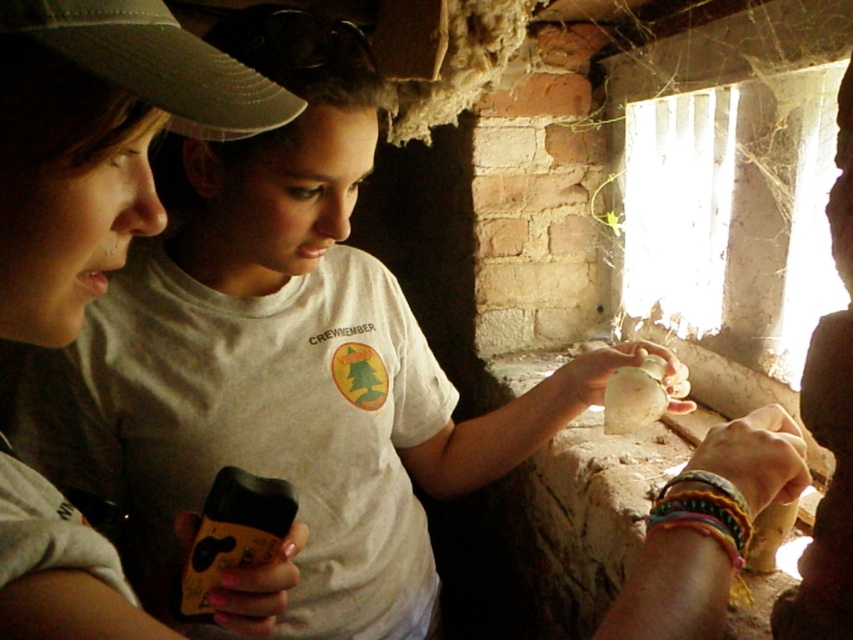
Question: Which point is farther to the camera?

Choices:
 (A) (238, 552)
 (B) (631, 381)
 (C) (83, 566)
 (D) (164, 67)

Answer: (B)

Question: Does white matte shirt at center have a smaller size compared to translucent glass bottle at center?

Choices:
 (A) yes
 (B) no

Answer: (B)

Question: Among these objects, which one is farthest from the camera?

Choices:
 (A) yellow matte smartphone at lower left
 (B) dark gray fabric baseball cap at upper left

Answer: (A)

Question: Does white matte shirt at center come in front of dark gray fabric baseball cap at upper left?

Choices:
 (A) yes
 (B) no

Answer: (B)

Question: Can you confirm if white matte shirt at center is positioned to the left of dark gray fabric baseball cap at upper left?

Choices:
 (A) no
 (B) yes

Answer: (B)

Question: Which point is farther to the camera?

Choices:
 (A) (136, 214)
 (B) (251, 540)
 (C) (103, 56)

Answer: (B)